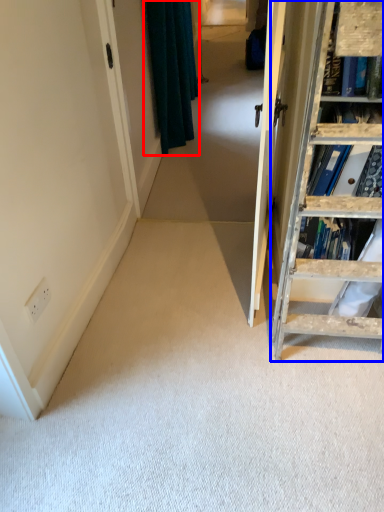
Question: Which object appears closest to the camera in this image, curtain (highlighted by a red box) or ladder (highlighted by a blue box)?

Choices:
 (A) curtain
 (B) ladder

Answer: (B)